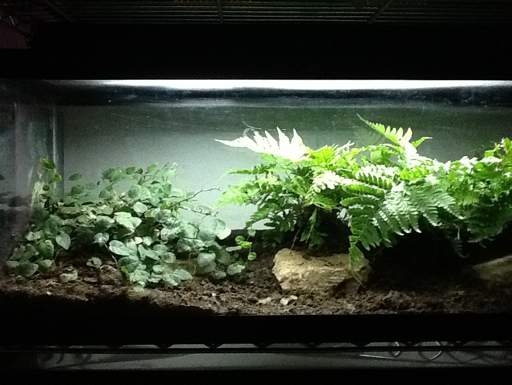
Where is `grate`? grate is located at coordinates pyautogui.click(x=186, y=7), pyautogui.click(x=281, y=8).